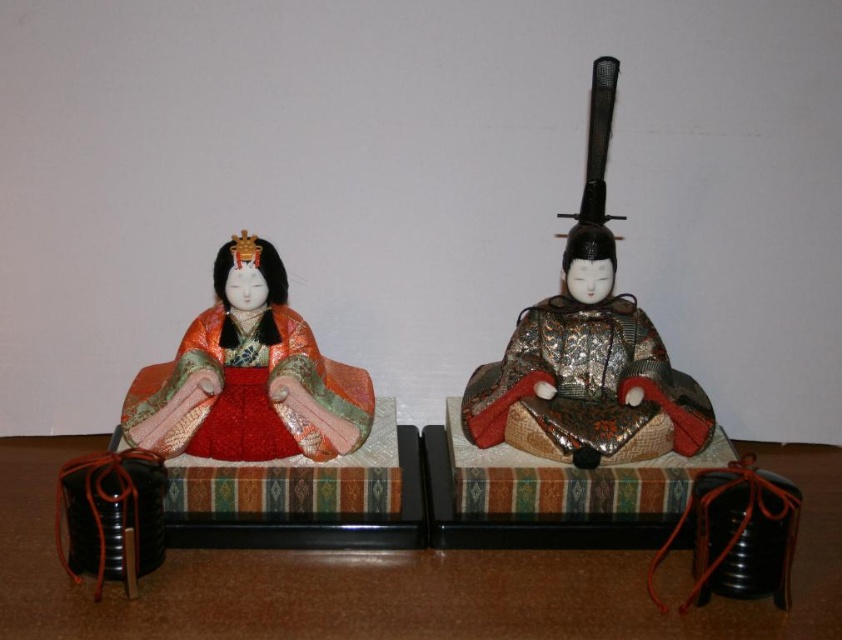
Is metallic gold armor at right positioned at the back of matte gold kimono at left?

No, it is not.

Can you confirm if metallic gold armor at right is wider than matte gold kimono at left?

→ No, metallic gold armor at right is not wider than matte gold kimono at left.

Identify the location of metallic gold armor at right. (585, 374).

Find the location of `metallic gold armor at right`. metallic gold armor at right is located at coordinates (585, 374).